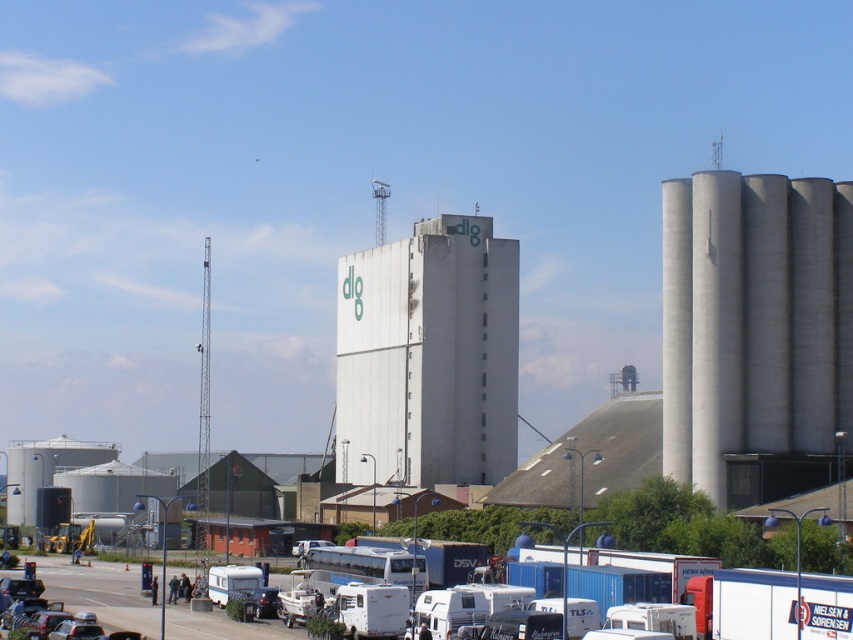
Question: Estimate the real-world distances between objects in this image. Which object is closer to the gray concrete silo at right?

Choices:
 (A) white matte camper van at center
 (B) white concrete silo at center

Answer: (B)

Question: Observing the image, what is the correct spatial positioning of white concrete silo at center in reference to white matte camper van at center?

Choices:
 (A) right
 (B) left

Answer: (B)

Question: Is the position of gray concrete silo at right less distant than that of white concrete silo at center?

Choices:
 (A) yes
 (B) no

Answer: (A)

Question: Estimate the real-world distances between objects in this image. Which object is closer to the white concrete silo at center?

Choices:
 (A) white matte camper van at center
 (B) gray concrete silo at right

Answer: (B)

Question: Which object is the farthest from the gray concrete silo at right?

Choices:
 (A) white matte camper van at center
 (B) white concrete silo at center

Answer: (A)

Question: Does gray concrete silo at right have a larger size compared to white matte camper van at center?

Choices:
 (A) yes
 (B) no

Answer: (A)